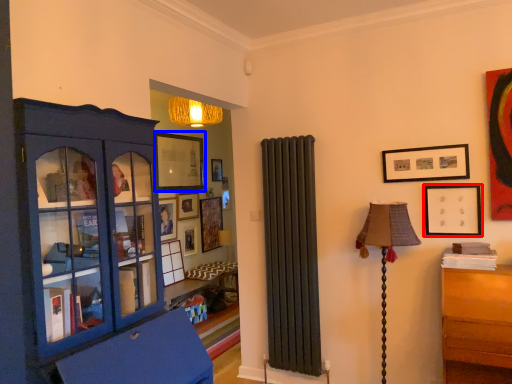
Question: Among these objects, which one is nearest to the camera, picture frame (highlighted by a red box) or picture frame (highlighted by a blue box)?

Choices:
 (A) picture frame
 (B) picture frame

Answer: (A)